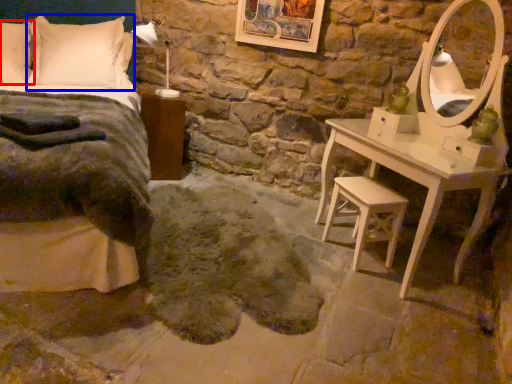
Question: Which object is closer to the camera taking this photo, pillow (highlighted by a red box) or pillow (highlighted by a blue box)?

Choices:
 (A) pillow
 (B) pillow

Answer: (A)